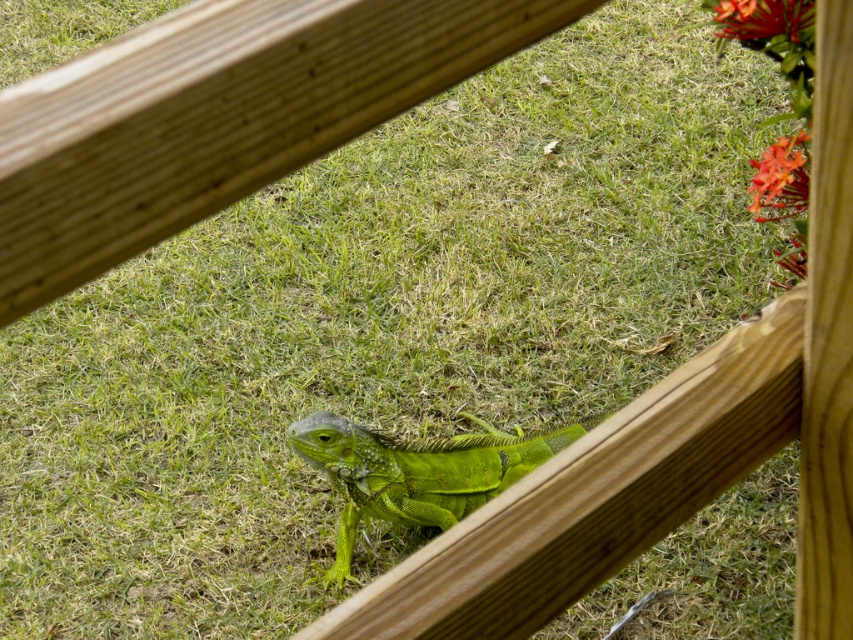
Question: Which point is farther to the camera?

Choices:
 (A) orange glossy flower at upper right
 (B) orange matte flower at upper right
 (C) light brown wooden rail at center

Answer: (B)

Question: Which point is farther from the camera taking this photo?

Choices:
 (A) (404, 502)
 (B) (45, 266)
 (C) (752, 205)
 (D) (793, 36)

Answer: (A)

Question: Where is light brown wooden rail at center located in relation to orange matte flower at upper right in the image?

Choices:
 (A) right
 (B) left

Answer: (B)

Question: Can you confirm if green scaly lizard at center is positioned to the left of orange matte flower at upper right?

Choices:
 (A) no
 (B) yes

Answer: (B)

Question: Among these objects, which one is farthest from the camera?

Choices:
 (A) green scaly lizard at center
 (B) orange glossy flower at upper right
 (C) orange matte flower at upper right
 (D) light brown wooden rail at center

Answer: (A)

Question: Does light brown wooden rail at center have a greater width compared to orange glossy flower at upper right?

Choices:
 (A) no
 (B) yes

Answer: (B)